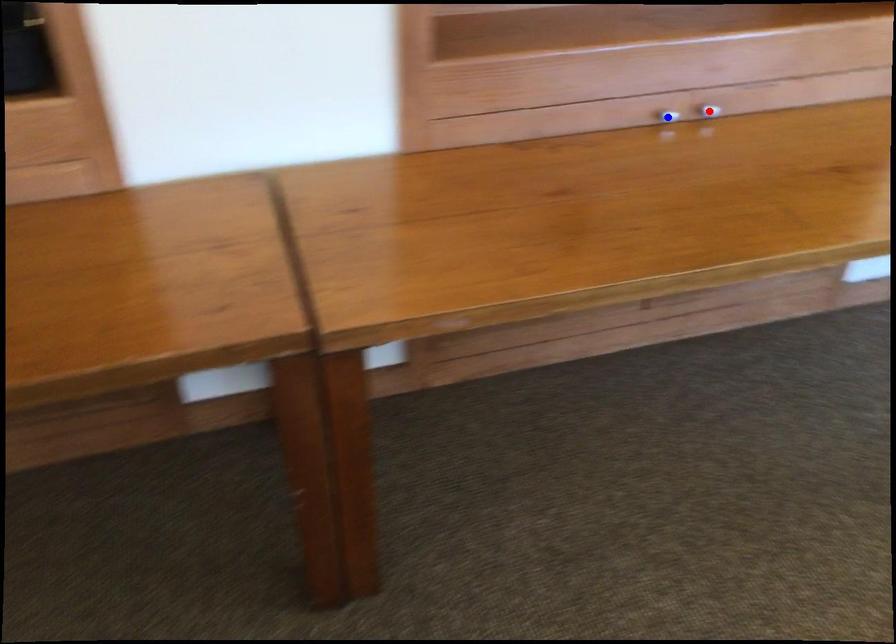
Question: In the image, two points are highlighted. Which point is nearer to the camera? Reply with the corresponding letter.

Choices:
 (A) blue point
 (B) red point

Answer: (A)